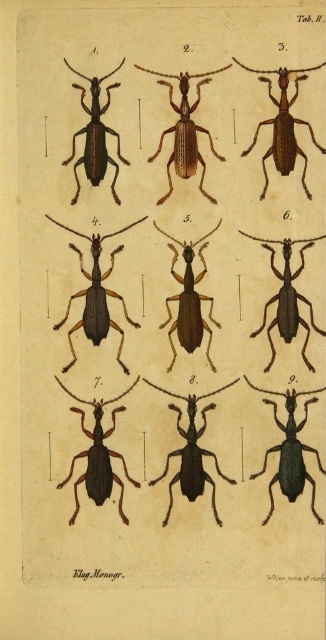
Question: Can you confirm if matte black beetle at center right is positioned below matte brown beetle at upper right?

Choices:
 (A) yes
 (B) no

Answer: (A)

Question: Which point appears farthest from the camera in this image?

Choices:
 (A) (257, 131)
 (B) (192, 451)

Answer: (B)

Question: Is matte brown beetle at upper right above matte black beetle at upper left?

Choices:
 (A) yes
 (B) no

Answer: (A)

Question: Which object is the farthest from the matte black beetle at center right?

Choices:
 (A) matte black beetle at upper right
 (B) brown matte beetle at center
 (C) matte brown beetle at upper right
 (D) matte black beetle at center

Answer: (C)

Question: Does matte brown beetle at center appear on the right side of brown matte beetle at center?

Choices:
 (A) yes
 (B) no

Answer: (B)

Question: Which object appears closest to the camera in this image?

Choices:
 (A) matte black beetle at lower left
 (B) brown matte beetle at center

Answer: (A)